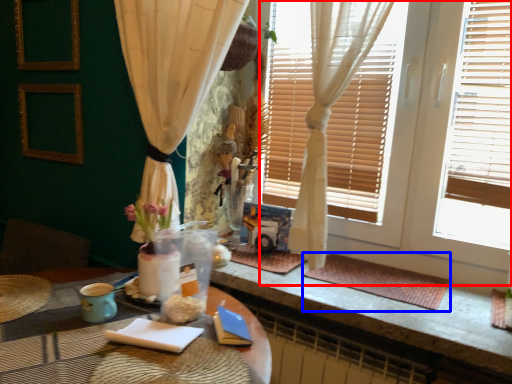
Question: Which of the following is the farthest to the observer, window frame (highlighted by a red box) or wide (highlighted by a blue box)?

Choices:
 (A) window frame
 (B) wide

Answer: (B)